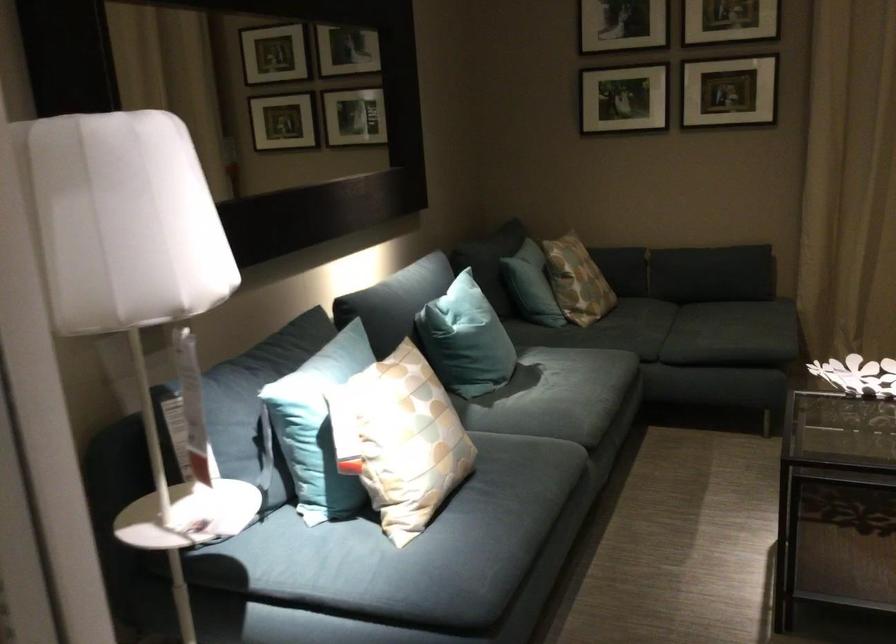
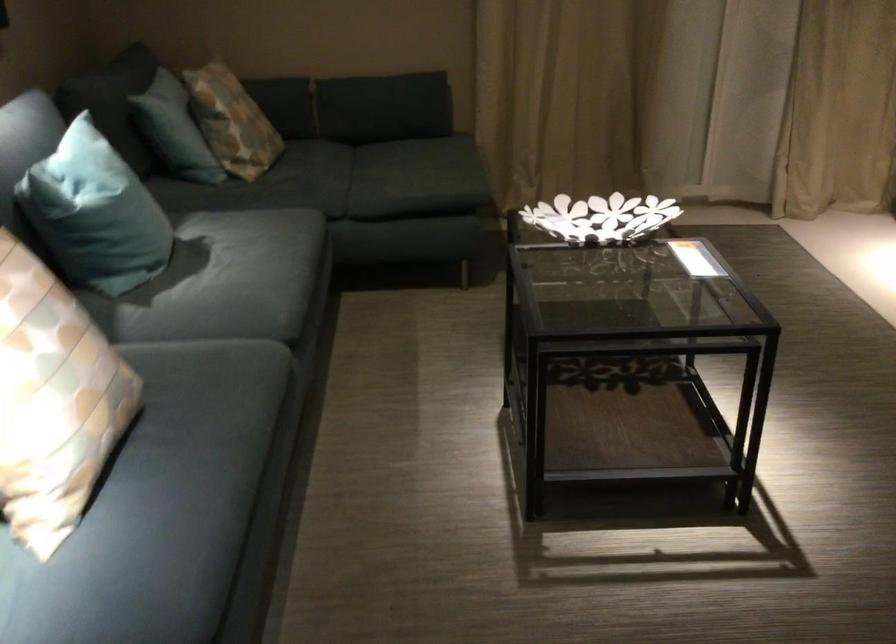
Question: Which direction would the cameraman need to move to produce the second image? Reply with the corresponding letter.

Choices:
 (A) Left
 (B) Right
 (C) Forward
 (D) Backward

Answer: (C)